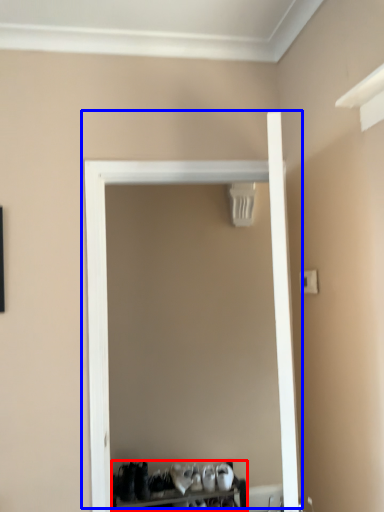
Question: Which object is further to the camera taking this photo, furniture (highlighted by a red box) or door (highlighted by a blue box)?

Choices:
 (A) furniture
 (B) door

Answer: (A)